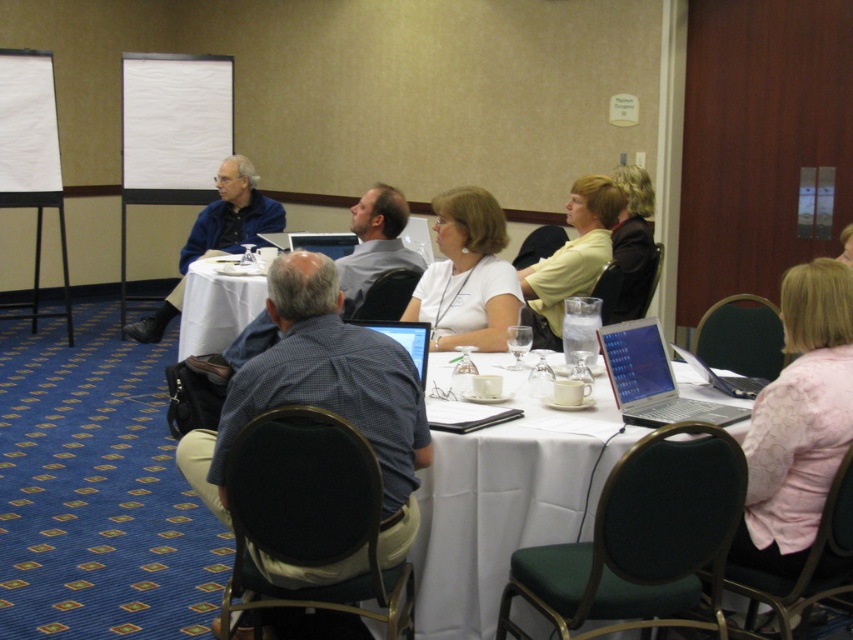
Is point (614, 397) behind point (624, 291)?

No, it is not.

Can you confirm if silver metallic laptop at center is wider than dark brown leather jacket at upper right?

Indeed, silver metallic laptop at center has a greater width compared to dark brown leather jacket at upper right.

Locate an element on the screen. silver metallic laptop at center is located at coordinates (653, 380).

Is white matte shirt at center behind silver metallic laptop at center?

Yes, it is.

Image resolution: width=853 pixels, height=640 pixels. What do you see at coordinates (467, 275) in the screenshot? I see `white matte shirt at center` at bounding box center [467, 275].

Which is behind, point (437, 336) or point (666, 380)?

Point (437, 336)

Where is `white matte shirt at center`? Image resolution: width=853 pixels, height=640 pixels. white matte shirt at center is located at coordinates (467, 275).

Does yellow matte shirt at upper center appear on the right side of gray checkered shirt at center?

Correct, you'll find yellow matte shirt at upper center to the right of gray checkered shirt at center.

At what (x,y) coordinates should I click in order to perform the action: click on yellow matte shirt at upper center. Please return your answer as a coordinate pair (x, y). Looking at the image, I should click on (572, 259).